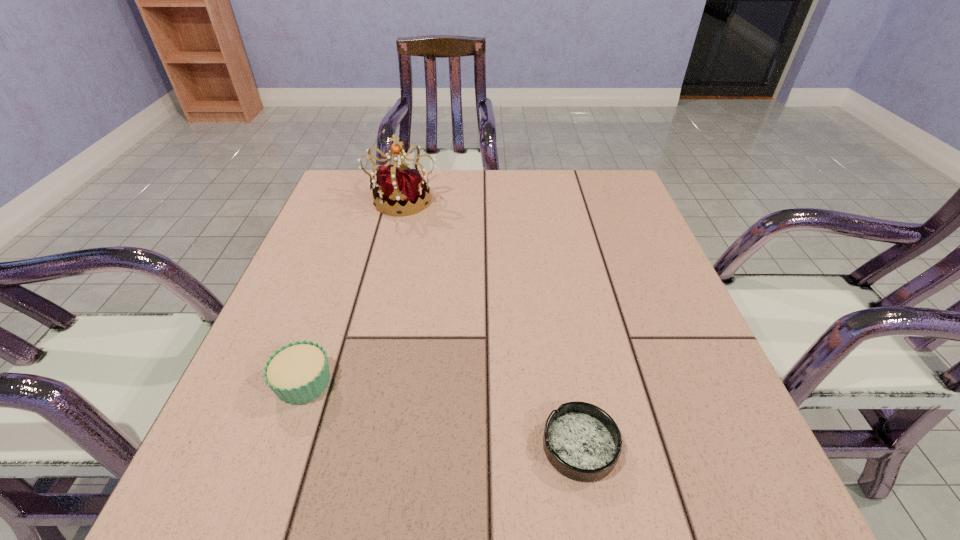
Identify which object is the second nearest to the tiara. Please provide its 2D coordinates. Your answer should be formatted as a tuple, i.e. [(x, y)], where the tuple contains the x and y coordinates of a point satisfying the conditions above.

[(581, 441)]

This screenshot has width=960, height=540. In order to click on vacant space that satisfies the following two spatial constraints: 1. on the front-facing side of the shortest object; 2. on the left side of the farthest object in this screenshot , I will do `click(343, 446)`.

In order to click on vacant position in the image that satisfies the following two spatial constraints: 1. on the front-facing side of the farthest object; 2. on the right side of the nearest object in this screenshot , I will do `click(343, 446)`.

Locate an element on the screen. The width and height of the screenshot is (960, 540). free space that satisfies the following two spatial constraints: 1. on the front-facing side of the farthest object; 2. on the right side of the rightmost object is located at coordinates (343, 446).